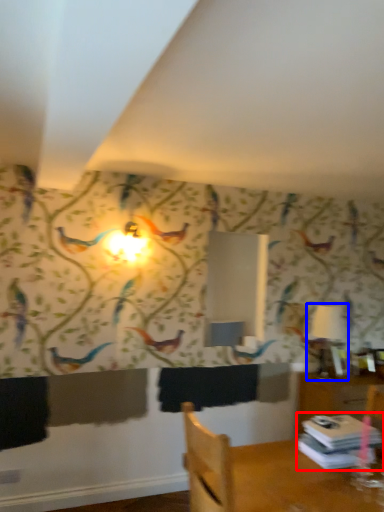
Question: Which object appears farthest to the camera in this image, book (highlighted by a red box) or table lamp (highlighted by a blue box)?

Choices:
 (A) book
 (B) table lamp

Answer: (B)